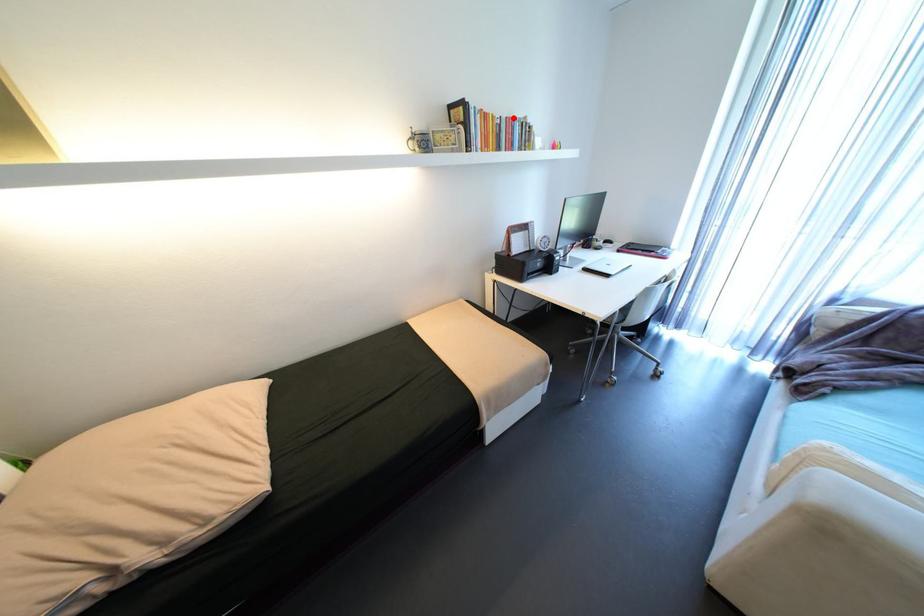
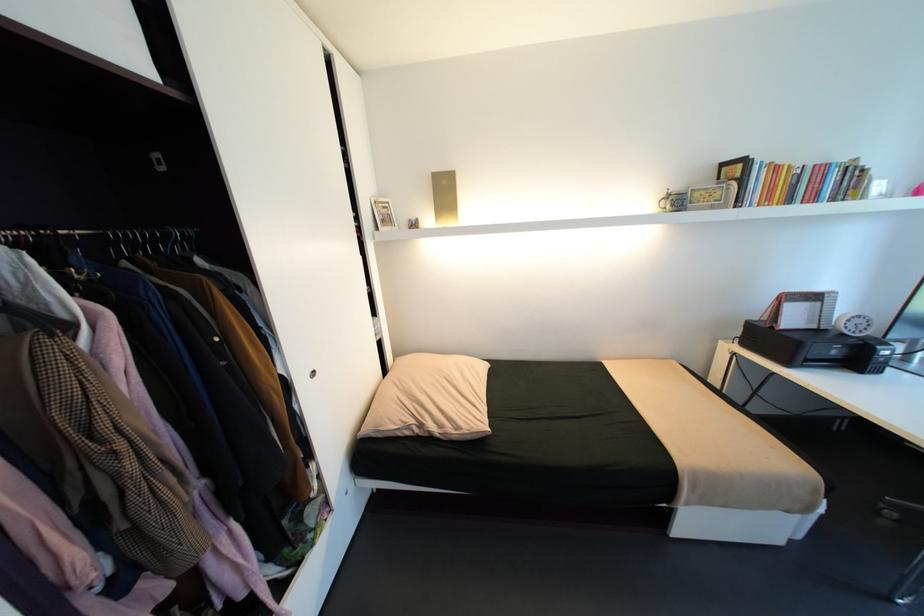
Find the pixel in the second image that matches the highlighted location in the first image.

(821, 166)